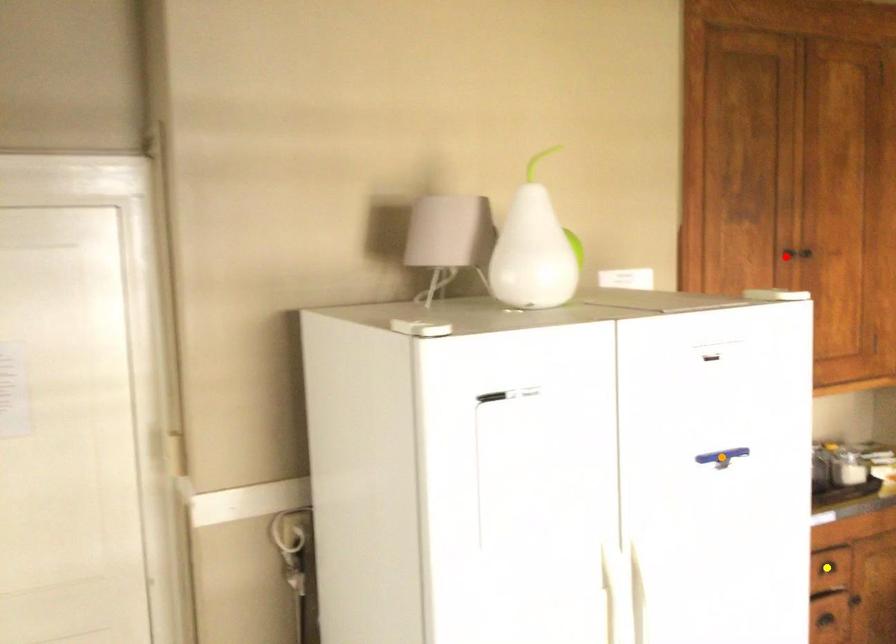
Order these from nearest to farthest:
red point | yellow point | orange point

orange point < yellow point < red point